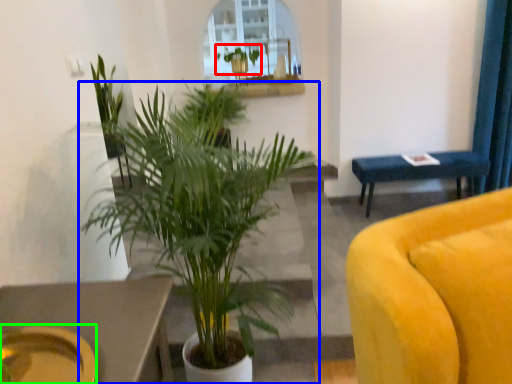
Question: Which object is the farthest from houseplant (highlighted by a red box)? Choose among these: houseplant (highlighted by a blue box) or platter (highlighted by a green box).

Choices:
 (A) houseplant
 (B) platter

Answer: (B)